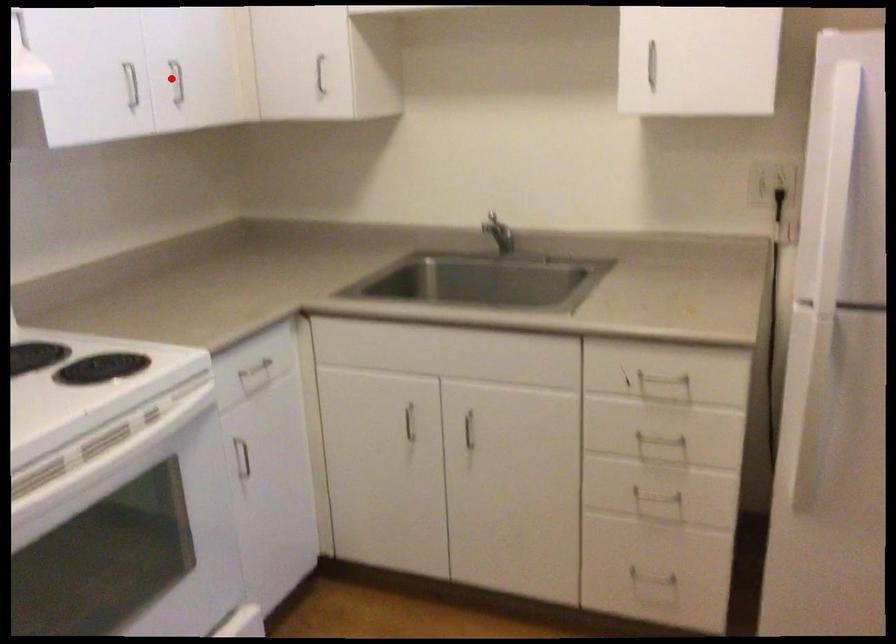
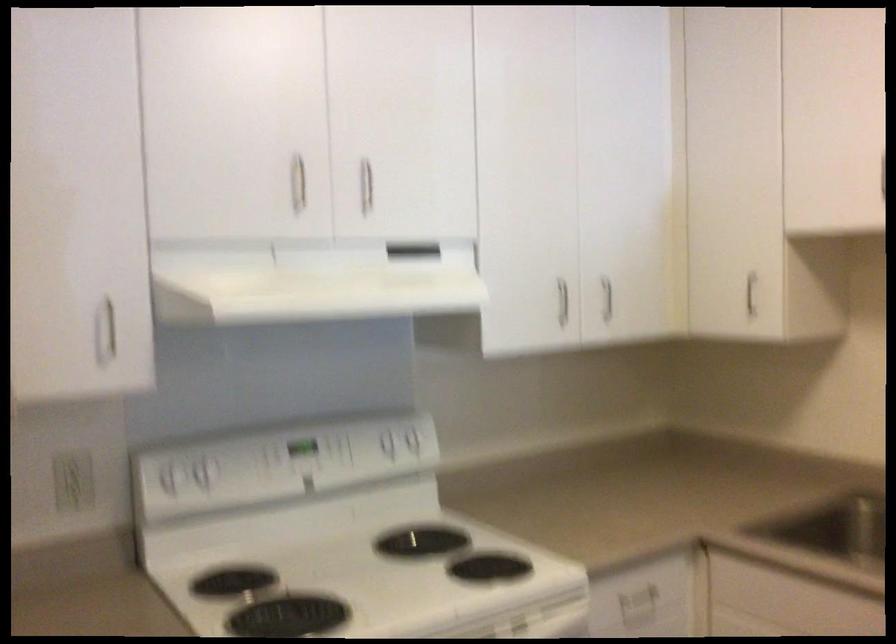
The point at the highlighted location is marked in the first image. Where is the corresponding point in the second image?

(607, 298)